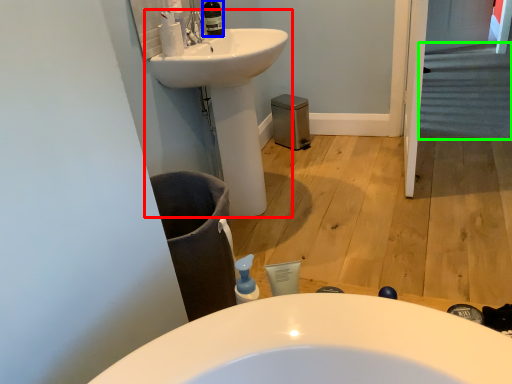
Question: Based on their relative distances, which object is nearer to sink (highlighted by a red box)? Choose from toiletry (highlighted by a blue box) and stairs (highlighted by a green box).

Choices:
 (A) toiletry
 (B) stairs

Answer: (A)